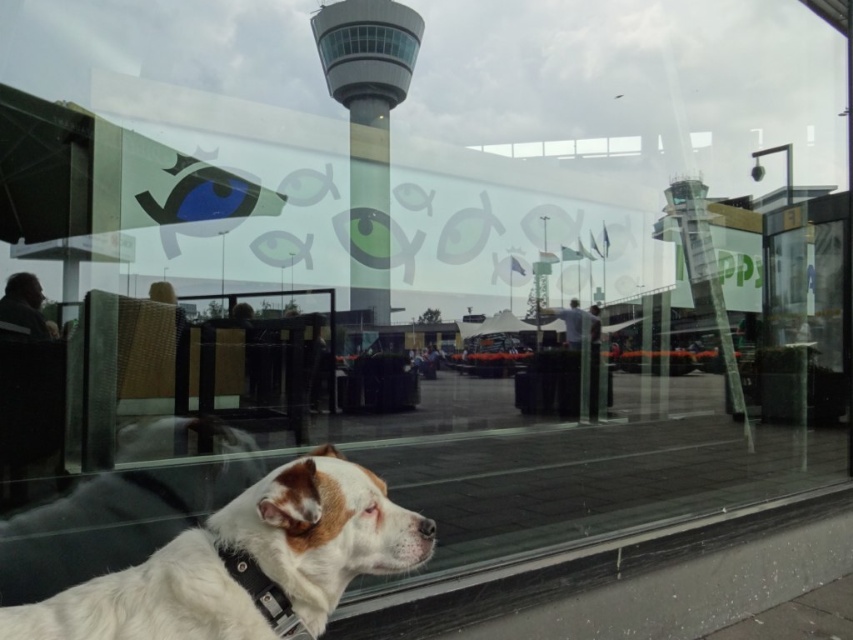
Question: Is white fur dog at lower left thinner than black leather neckband at lower left?

Choices:
 (A) no
 (B) yes

Answer: (A)

Question: Does smooth glass control tower at center come behind black leather neckband at lower left?

Choices:
 (A) no
 (B) yes

Answer: (B)

Question: Does smooth glass control tower at center have a lesser width compared to black leather neckband at lower left?

Choices:
 (A) no
 (B) yes

Answer: (A)

Question: Among these objects, which one is nearest to the camera?

Choices:
 (A) black leather neckband at lower left
 (B) white fur dog at lower left
 (C) smooth glass control tower at center

Answer: (B)

Question: Among these objects, which one is nearest to the camera?

Choices:
 (A) black leather neckband at lower left
 (B) white fur dog at lower left
 (C) smooth glass control tower at center

Answer: (B)

Question: Estimate the real-world distances between objects in this image. Which object is farther from the black leather neckband at lower left?

Choices:
 (A) smooth glass control tower at center
 (B) white fur dog at lower left

Answer: (A)